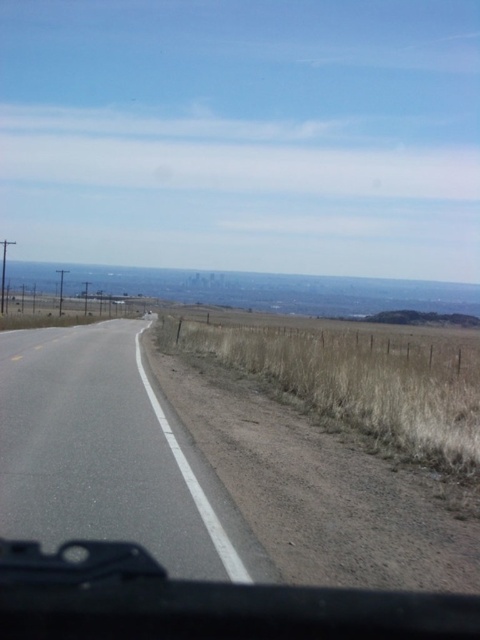
You are driving a car and need to stay within the road. Based on the image, what is the position of the asphalt road at center relative to your vehicle?

The asphalt road at center is located at point 0.711 on the x axis and 0.223 on the y axis relative to your vehicle. This means the road is positioned slightly to the right and forward from your current position inside the vehicle.

Based on the photo, you are driving a car and need to stay within the lanes. Based on the image, which object, the asphalt road at center or the urban skyline at center, would appear closer to you and why?

The asphalt road at center appears closer because it is thinner than the urban skyline at center, indicating it is nearer to the observer.

You are a driver sitting in the car and looking forward. The car is 4.8 meters long. If you want to park the car completely on the asphalt road at center, will the road be long enough to accommodate the entire length of your car?

The asphalt road at center and camera are 3.65 meters apart from each other. Since the car is 4.8 meters long, the road is not long enough to accommodate the entire length of the car.